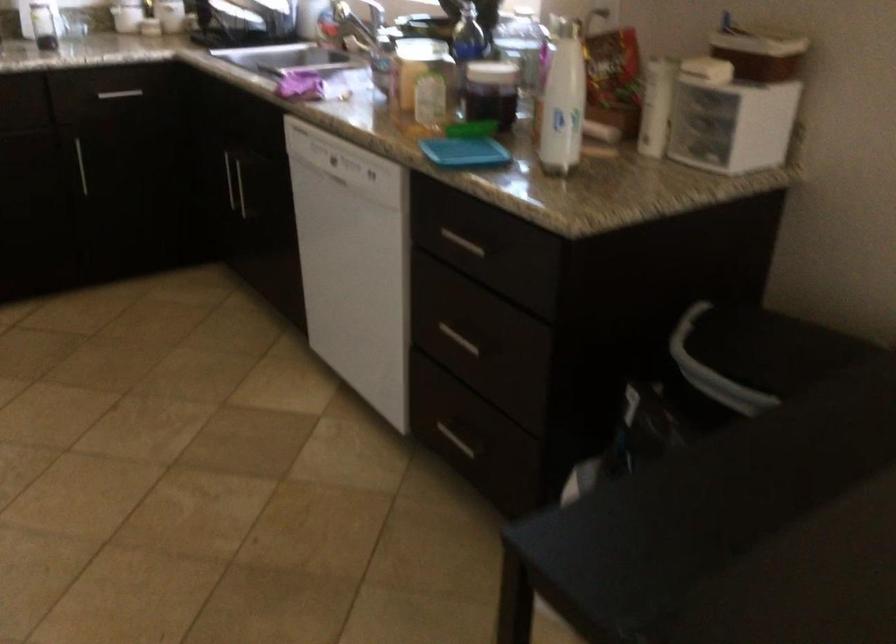
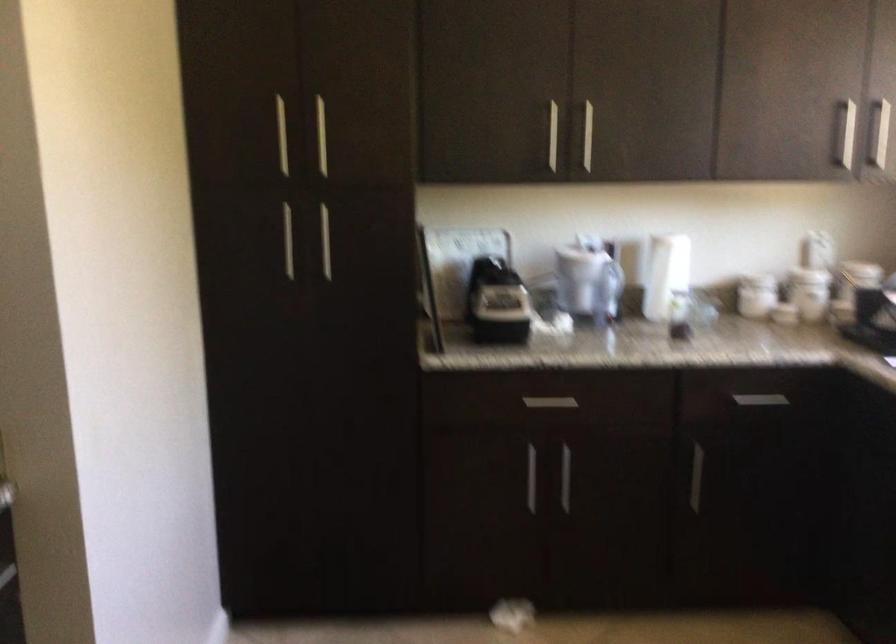
Question: The camera is either moving clockwise (left) or counter-clockwise (right) around the object. The first image is from the beginning of the video and the second image is from the end. Is the camera moving left or right when shooting the video?

Choices:
 (A) Left
 (B) Right

Answer: (B)